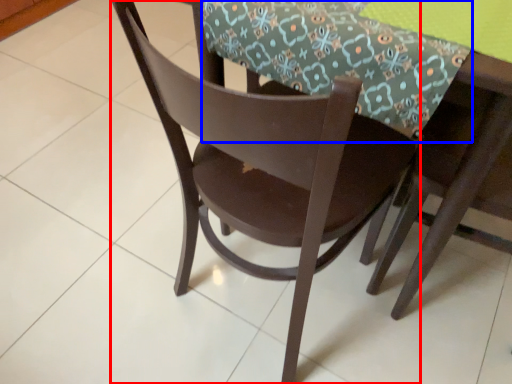
Question: Which object is closer to the camera taking this photo, chair (highlighted by a red box) or tablecloth (highlighted by a blue box)?

Choices:
 (A) chair
 (B) tablecloth

Answer: (A)